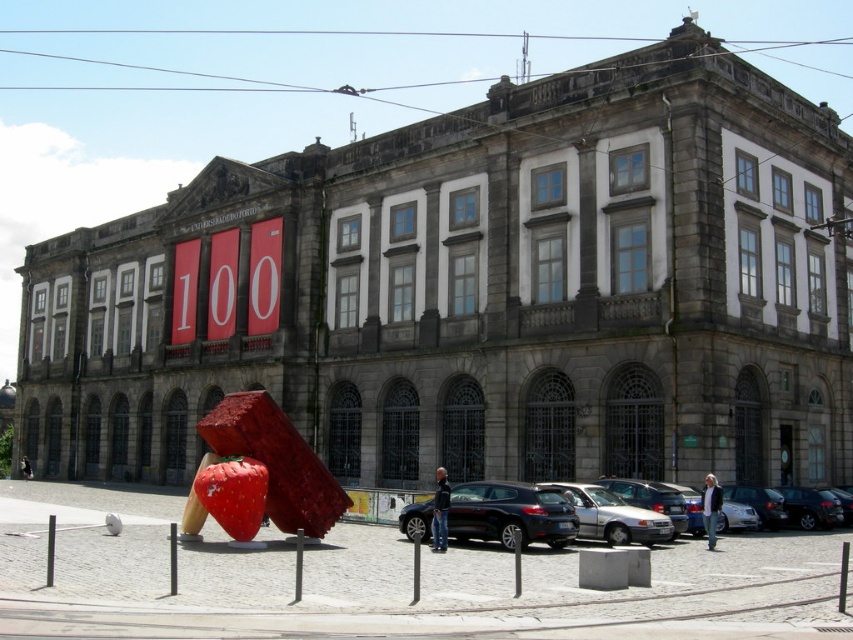
How far apart are silver metallic car at lower center and shiny black car at center?

silver metallic car at lower center and shiny black car at center are 4.38 feet apart.

Does silver metallic car at lower center have a greater width compared to shiny black car at center?

Indeed, silver metallic car at lower center has a greater width compared to shiny black car at center.

Is point (590, 493) closer to viewer compared to point (505, 504)?

No, (590, 493) is further to viewer.

Where is `silver metallic car at lower center`? The width and height of the screenshot is (853, 640). silver metallic car at lower center is located at coordinates (567, 513).